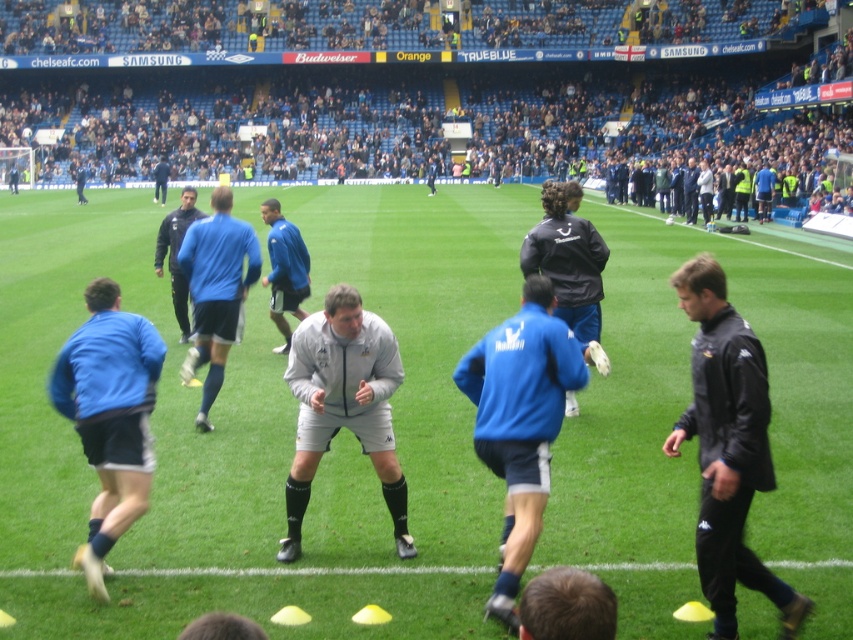
Is point (572, 250) positioned after point (155, 188)?

No.

Which is behind, point (573, 275) or point (164, 168)?

Point (164, 168)

Image resolution: width=853 pixels, height=640 pixels. In order to click on black leather jacket at center in this screenshot , I will do `click(567, 260)`.

Consider the image. Which of these two, black leather jacket at right or blue fabric jacket at center, stands taller?

blue fabric jacket at center is taller.

Does black leather jacket at right have a greater width compared to blue fabric jacket at center?

In fact, black leather jacket at right might be narrower than blue fabric jacket at center.

Which is in front, point (722, 580) or point (169, 260)?

Point (722, 580) is more forward.

At what (x,y) coordinates should I click in order to perform the action: click on black leather jacket at right. Please return your answer as a coordinate pair (x, y). The height and width of the screenshot is (640, 853). Looking at the image, I should click on (727, 448).

Is black leather jacket at right above blue matte jacket at center?

Yes.

Identify the location of black leather jacket at right. (727, 448).

Which is behind, point (680, 300) or point (509, 356)?

The point (509, 356) is behind.

Find the location of `black leather jacket at right`. black leather jacket at right is located at coordinates (727, 448).